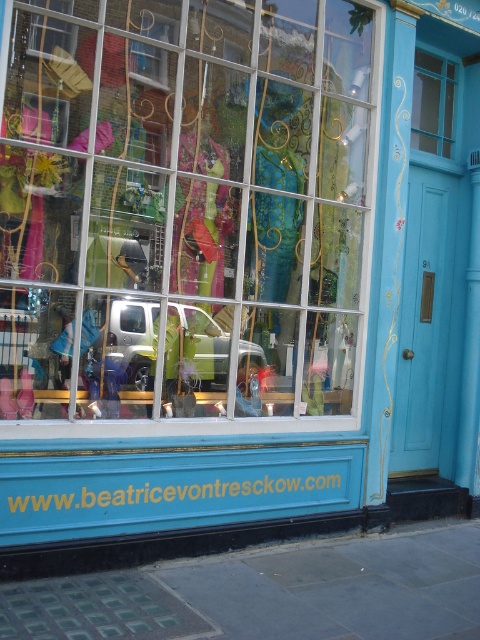
Between matte glass window at center and transparent glass window at upper right, which one is positioned lower?

matte glass window at center is below.

Is point (325, 262) less distant than point (447, 120)?

Yes.

Locate an element on the screen. The height and width of the screenshot is (640, 480). matte glass window at center is located at coordinates (183, 211).

Can you confirm if teal fabric dress at center is smaller than clear glass window at upper center?

Incorrect, teal fabric dress at center is not smaller in size than clear glass window at upper center.

Who is positioned more to the left, teal fabric dress at center or clear glass window at upper center?

Positioned to the left is clear glass window at upper center.

The image size is (480, 640). I want to click on teal fabric dress at center, so click(x=280, y=136).

Can you confirm if matte glass window at center is wider than teal fabric dress at center?

Correct, the width of matte glass window at center exceeds that of teal fabric dress at center.

Describe the element at coordinates (183, 211) in the screenshot. This screenshot has width=480, height=640. I see `matte glass window at center` at that location.

Describe the element at coordinates (183, 211) in the screenshot. The height and width of the screenshot is (640, 480). I see `matte glass window at center` at that location.

The image size is (480, 640). What are the coordinates of `matte glass window at center` in the screenshot? It's located at (183, 211).